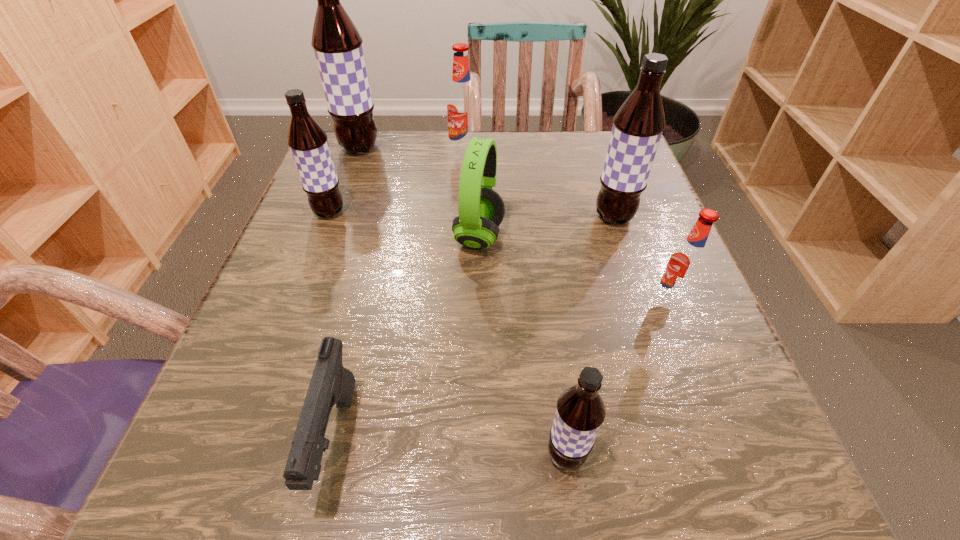
You are a GUI agent. You are given a task and a screenshot of the screen. Output one action in this format:
    pyautogui.click(x=<x>, y=<y>)
    Task: Click on the vacant space located on the left of the sixth object from left to right
    
    Given the screenshot: What is the action you would take?
    pyautogui.click(x=504, y=455)

Where is `root beer located at the near edge`? This screenshot has width=960, height=540. root beer located at the near edge is located at coordinates (580, 411).

Find the location of a particular element. The height and width of the screenshot is (540, 960). pistol present at the near edge is located at coordinates (331, 383).

The image size is (960, 540). In order to click on object present at the far left corner in this screenshot , I will do `click(337, 44)`.

You are a GUI agent. You are given a task and a screenshot of the screen. Output one action in this format:
    pyautogui.click(x=<x>, y=<y>)
    Task: Click on the vacant region at the far edge of the desktop
    
    Given the screenshot: What is the action you would take?
    pyautogui.click(x=417, y=153)

You are a GUI agent. You are given a task and a screenshot of the screen. Output one action in this format:
    pyautogui.click(x=<x>, y=<y>)
    Task: Click on the vacant space at the left edge of the desktop
    The width and height of the screenshot is (960, 540).
    Given the screenshot: What is the action you would take?
    pyautogui.click(x=370, y=252)

This screenshot has height=540, width=960. I want to click on vacant space at the right edge of the desktop, so click(x=646, y=259).

Locate an element on the screen. The width and height of the screenshot is (960, 540). vacant space at the far left corner of the desktop is located at coordinates (361, 164).

Where is `vacant region between the second smallest brown root beer and the nearest brown root beer`? Image resolution: width=960 pixels, height=540 pixels. vacant region between the second smallest brown root beer and the nearest brown root beer is located at coordinates (447, 334).

I want to click on free spot between the third nearest object and the third root beer from right to left, so click(x=617, y=379).